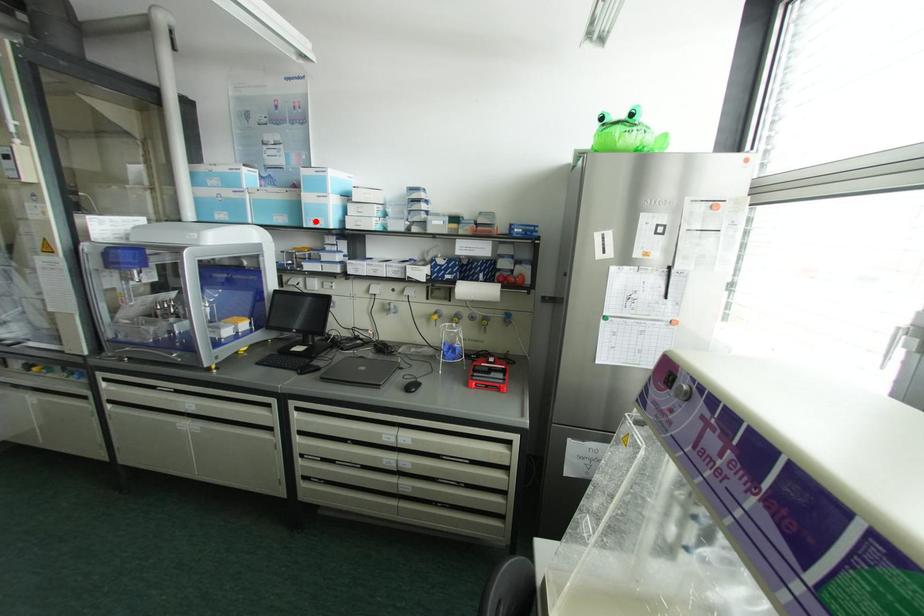
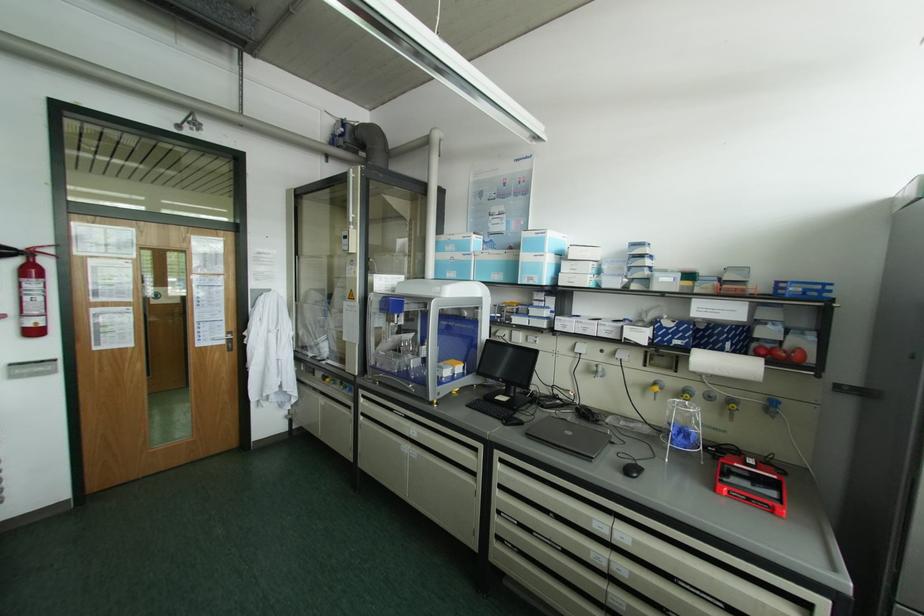
In the second image, find the point that corresponds to the highlighted location in the first image.

(530, 278)